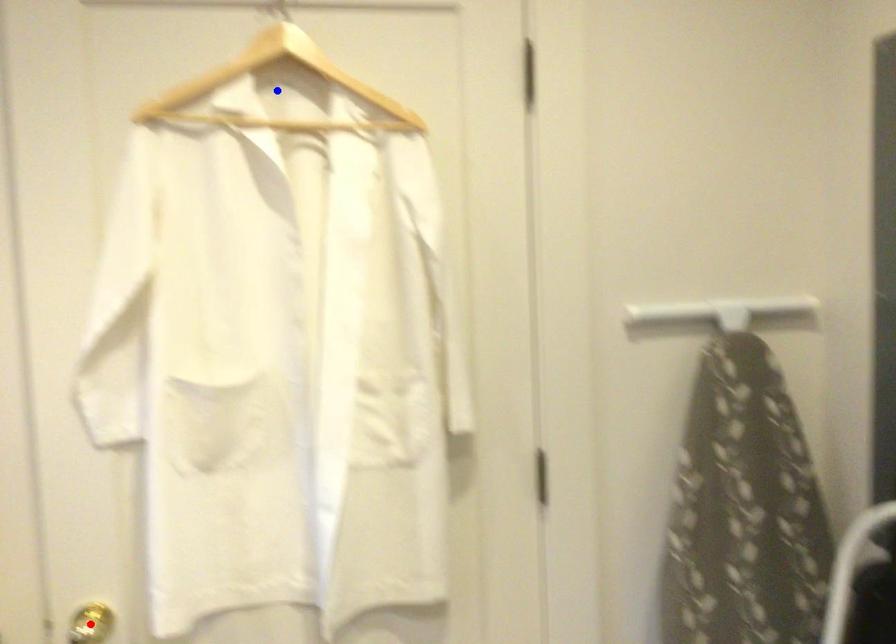
Question: Which of the two points in the image is closer to the camera?

Choices:
 (A) Blue point is closer.
 (B) Red point is closer.

Answer: (A)